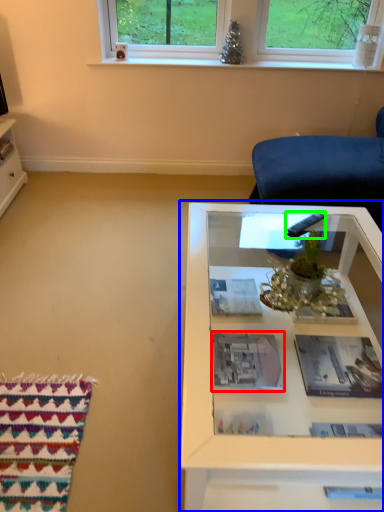
Question: Which object is the farthest from book (highlighted by a red box)? Choose among these: table (highlighted by a blue box) or remote (highlighted by a green box).

Choices:
 (A) table
 (B) remote

Answer: (B)